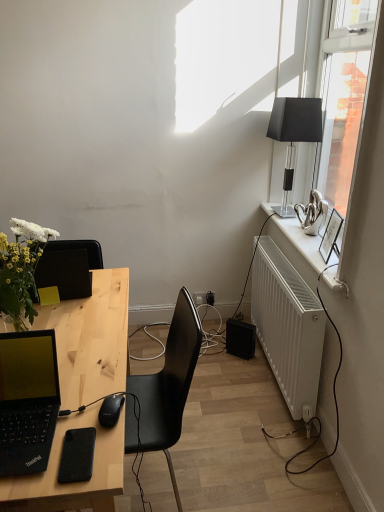
You are a GUI agent. You are given a task and a screenshot of the screen. Output one action in this format:
    pyautogui.click(x=<x>, y=<y>)
    Task: Click on the free space to the back side of black matte phone at lower left
    
    Given the screenshot: What is the action you would take?
    pyautogui.click(x=84, y=403)